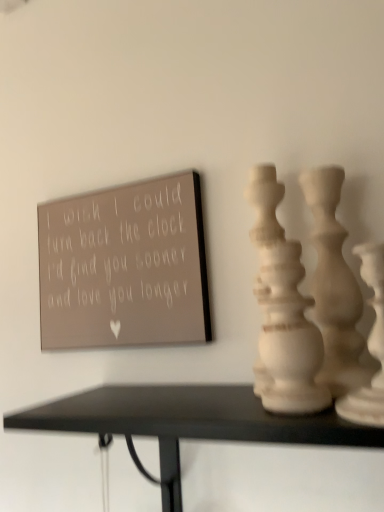
Locate an element on the screen. This screenshot has width=384, height=512. white matte vase at center, arranged as the second vase when viewed from the front is located at coordinates (283, 310).

This screenshot has height=512, width=384. Describe the element at coordinates (125, 266) in the screenshot. I see `matte gray sign at upper left` at that location.

Measure the distance between white matte vase at right, the third vase when ordered from front to back, and camera.

A distance of 16.85 inches exists between white matte vase at right, the third vase when ordered from front to back, and camera.

Describe the element at coordinates (334, 285) in the screenshot. Image resolution: width=384 pixels, height=512 pixels. I see `white matte vase at right, which is the first vase in back-to-front order` at that location.

At what (x,y) coordinates should I click in order to perform the action: click on white matte vase at center, arranged as the second vase when viewed from the front. Please return your answer as a coordinate pair (x, y). Looking at the image, I should click on (283, 310).

Is point (279, 187) closer or farther from the camera than point (105, 277)?

Point (279, 187).

Is the position of white matte vase at center, arranged as the second vase when viewed from the front, less distant than that of matte gray sign at upper left?

Yes.

Would you consider white matte vase at center, which is the second vase from back to front, to be distant from matte gray sign at upper left?

No.

From the image's perspective, is white matte vase at center, which is the second vase from back to front, positioned above or below matte gray sign at upper left?

From the image's perspective, white matte vase at center, which is the second vase from back to front, appears below matte gray sign at upper left.

Choose the correct answer: Is matte gray sign at upper left inside white matte vase at center, arranged as the second vase when viewed from the front, or outside it?

matte gray sign at upper left is not enclosed by white matte vase at center, arranged as the second vase when viewed from the front.

From a real-world perspective, which object stands above the other?

matte gray sign at upper left, from a real-world perspective.

Considering the positions of points (171, 257) and (268, 319), is point (171, 257) farther from camera compared to point (268, 319)?

Yes.

Considering the sizes of objects matte gray sign at upper left and white matte vase at center, which is the second vase from back to front, in the image provided, who is shorter, matte gray sign at upper left or white matte vase at center, which is the second vase from back to front,?

white matte vase at center, which is the second vase from back to front, is shorter.

Based on the photo, from a real-world perspective, is white matte vase at center, arranged as the second vase when viewed from the front, located beneath white matte vase at right, acting as the third vase starting from the back?

Actually, white matte vase at center, arranged as the second vase when viewed from the front, is physically above white matte vase at right, acting as the third vase starting from the back, in the real world.

Considering the positions of points (313, 346) and (375, 342), is point (313, 346) closer to camera compared to point (375, 342)?

Yes, point (313, 346) is in front of point (375, 342).

Considering the positions of objects white matte vase at center, which is the second vase from back to front, and white matte vase at right, the first vase when ordered from front to back, in the image provided, who is behind, white matte vase at center, which is the second vase from back to front, or white matte vase at right, the first vase when ordered from front to back,?

white matte vase at center, which is the second vase from back to front, is further from the camera.

Is white matte vase at right, acting as the third vase starting from the back, a part of white matte vase at center, which is the second vase from back to front?

Actually, white matte vase at right, acting as the third vase starting from the back, is outside white matte vase at center, which is the second vase from back to front.

From a real-world perspective, is white matte vase at right, acting as the third vase starting from the back, located beneath white matte vase at center, which is the second vase from back to front?

Yes, from a real-world perspective, white matte vase at right, acting as the third vase starting from the back, is under white matte vase at center, which is the second vase from back to front.

Is point (358, 407) closer to viewer compared to point (283, 374)?

Yes, point (358, 407) is closer to viewer.

Can you confirm if white matte vase at right, acting as the third vase starting from the back, is shorter than white matte vase at center, which is the second vase from back to front?

Yes, white matte vase at right, acting as the third vase starting from the back, is shorter than white matte vase at center, which is the second vase from back to front.

From the image's perspective, is white matte vase at right, the first vase when ordered from front to back, above or below white matte vase at right, which is the first vase in back-to-front order?

white matte vase at right, the first vase when ordered from front to back, is situated lower than white matte vase at right, which is the first vase in back-to-front order, in the image.

Considering the relative positions of white matte vase at right, the first vase when ordered from front to back, and white matte vase at right, the third vase when ordered from front to back, in the image provided, is white matte vase at right, the first vase when ordered from front to back, to the left of white matte vase at right, the third vase when ordered from front to back, from the viewer's perspective?

Incorrect, white matte vase at right, the first vase when ordered from front to back, is not on the left side of white matte vase at right, the third vase when ordered from front to back.

Can you confirm if white matte vase at right, the first vase when ordered from front to back, is shorter than white matte vase at right, the third vase when ordered from front to back?

Correct, white matte vase at right, the first vase when ordered from front to back, is not as tall as white matte vase at right, the third vase when ordered from front to back.

Considering the points (374, 345) and (349, 373), which point is in front, point (374, 345) or point (349, 373)?

Point (349, 373)

Which of these two, white matte vase at right, acting as the third vase starting from the back, or matte gray sign at upper left, is bigger?

Bigger between the two is matte gray sign at upper left.

From the picture: From the image's perspective, which is below, white matte vase at right, acting as the third vase starting from the back, or matte gray sign at upper left?

white matte vase at right, acting as the third vase starting from the back.

Based on the photo, from a real-world perspective, is white matte vase at right, the first vase when ordered from front to back, located higher than matte gray sign at upper left?

Actually, white matte vase at right, the first vase when ordered from front to back, is physically below matte gray sign at upper left in the real world.

In terms of height, does white matte vase at right, the third vase when ordered from front to back, look taller or shorter compared to white matte vase at right, the first vase when ordered from front to back?

Clearly, white matte vase at right, the third vase when ordered from front to back, is taller compared to white matte vase at right, the first vase when ordered from front to back.

From the image's perspective, which is below, white matte vase at right, the third vase when ordered from front to back, or white matte vase at right, acting as the third vase starting from the back?

white matte vase at right, acting as the third vase starting from the back.

Looking at their sizes, would you say white matte vase at right, which is the first vase in back-to-front order, is wider or thinner than white matte vase at right, the first vase when ordered from front to back?

Clearly, white matte vase at right, which is the first vase in back-to-front order, has less width compared to white matte vase at right, the first vase when ordered from front to back.

From a real-world perspective, is white matte vase at right, which is the first vase in back-to-front order, located beneath white matte vase at right, acting as the third vase starting from the back?

No, from a real-world perspective, white matte vase at right, which is the first vase in back-to-front order, is not under white matte vase at right, acting as the third vase starting from the back.

Identify the location of bulletin board on the left of the white matte vase at center, which is the second vase from back to front. (125, 266).

In the image, there is a white matte vase at center, arranged as the second vase when viewed from the front. At what (x,y) coordinates should I click in order to perform the action: click on bulletin board above it (from the image's perspective). Please return your answer as a coordinate pair (x, y). Image resolution: width=384 pixels, height=512 pixels. Looking at the image, I should click on (125, 266).

Estimate the real-world distances between objects in this image. Which object is closer to white matte vase at right, the third vase when ordered from front to back, white matte vase at center, arranged as the second vase when viewed from the front, or white matte vase at right, acting as the third vase starting from the back?

white matte vase at center, arranged as the second vase when viewed from the front, lies closer to white matte vase at right, the third vase when ordered from front to back, than the other object.

Based on their spatial positions, is white matte vase at right, acting as the third vase starting from the back, or white matte vase at right, which is the first vase in back-to-front order, closer to white matte vase at center, which is the second vase from back to front?

white matte vase at right, which is the first vase in back-to-front order, lies closer to white matte vase at center, which is the second vase from back to front, than the other object.

Based on their spatial positions, is white matte vase at right, acting as the third vase starting from the back, or white matte vase at center, arranged as the second vase when viewed from the front, closer to white matte vase at right, which is the first vase in back-to-front order?

Among the two, white matte vase at center, arranged as the second vase when viewed from the front, is located nearer to white matte vase at right, which is the first vase in back-to-front order.

Based on their spatial positions, is white matte vase at center, which is the second vase from back to front, or white matte vase at right, the third vase when ordered from front to back, closer to matte gray sign at upper left?

white matte vase at center, which is the second vase from back to front, is closer to matte gray sign at upper left.

Looking at the image, which one is located closer to white matte vase at right, the first vase when ordered from front to back, white matte vase at right, the third vase when ordered from front to back, or white matte vase at center, which is the second vase from back to front?

white matte vase at right, the third vase when ordered from front to back, is positioned closer to the anchor white matte vase at right, the first vase when ordered from front to back.

When comparing their distances from matte gray sign at upper left, does white matte vase at right, which is the first vase in back-to-front order, or white matte vase at center, arranged as the second vase when viewed from the front, seem further?

white matte vase at right, which is the first vase in back-to-front order, lies further to matte gray sign at upper left than the other object.

Considering their positions, is white matte vase at center, which is the second vase from back to front, positioned further to white matte vase at right, acting as the third vase starting from the back, than white matte vase at right, which is the first vase in back-to-front order?

Among the two, white matte vase at center, which is the second vase from back to front, is located further to white matte vase at right, acting as the third vase starting from the back.

Considering their positions, is matte gray sign at upper left positioned closer to white matte vase at right, which is the first vase in back-to-front order, than white matte vase at center, arranged as the second vase when viewed from the front?

The object closer to white matte vase at right, which is the first vase in back-to-front order, is white matte vase at center, arranged as the second vase when viewed from the front.

Find the location of a particular element. This screenshot has height=512, width=384. vase positioned between white matte vase at right, the first vase when ordered from front to back, and white matte vase at right, which is the first vase in back-to-front order, from near to far is located at coordinates pyautogui.click(x=283, y=310).

At what (x,y) coordinates should I click in order to perform the action: click on vase between matte gray sign at upper left and white matte vase at right, the third vase when ordered from front to back, in the horizontal direction. Please return your answer as a coordinate pair (x, y). Looking at the image, I should click on (283, 310).